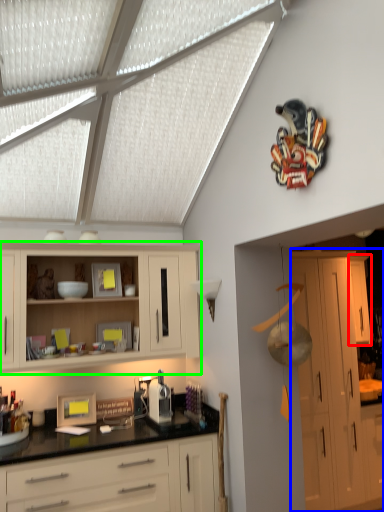
Question: Considering the real-world distances, which object is closest to cabinetry (highlighted by a red box)? cabinetry (highlighted by a blue box) or cabinetry (highlighted by a green box).

Choices:
 (A) cabinetry
 (B) cabinetry

Answer: (A)